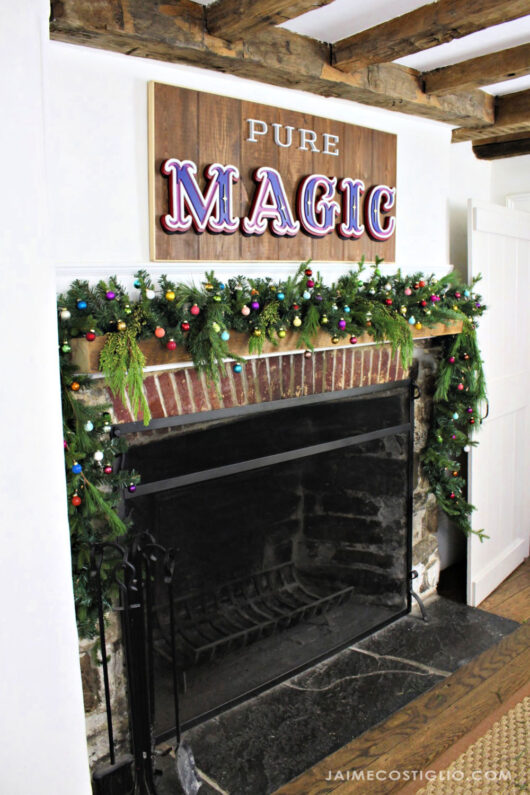
Locate an element on the screen. The width and height of the screenshot is (530, 795). white wall background empty space is located at coordinates (49, 738), (26, 525), (20, 207), (97, 128), (119, 212), (424, 183), (427, 242), (477, 183), (519, 184).